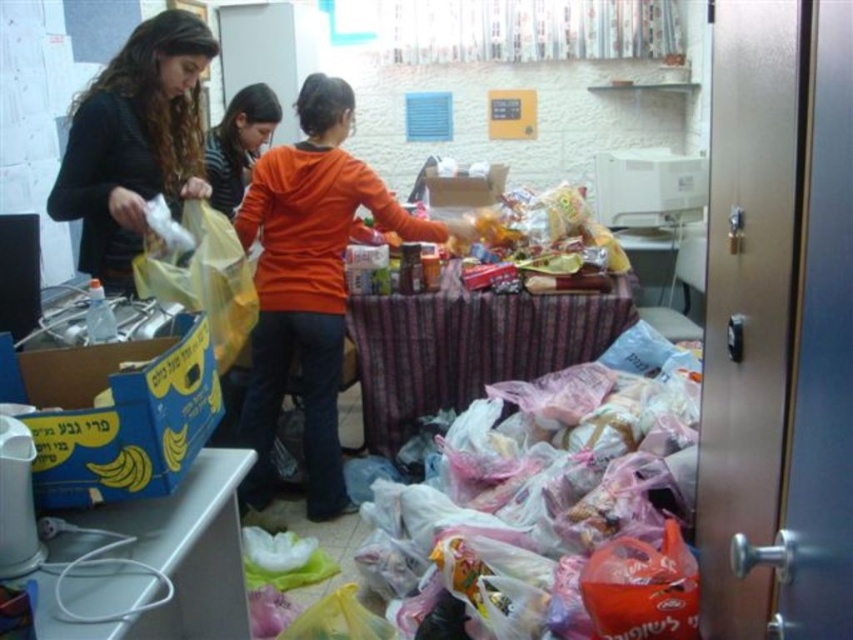
Which is below, orange matte sweater at center or blue cardboard box at lower left?

blue cardboard box at lower left

Can you confirm if orange matte sweater at center is positioned to the right of blue cardboard box at lower left?

Yes, orange matte sweater at center is to the right of blue cardboard box at lower left.

Locate an element on the screen. This screenshot has height=640, width=853. orange matte sweater at center is located at coordinates (309, 285).

Is point (454, 378) less distant than point (108, 472)?

No, (454, 378) is further to viewer.

Is point (352, 339) closer to camera compared to point (115, 464)?

No, (352, 339) is behind (115, 464).

Find the location of `wooden table at center`. wooden table at center is located at coordinates (468, 346).

Does point (212, 132) lie behind point (115, 461)?

Yes, point (212, 132) is behind point (115, 461).

Does orange matte shirt at center come in front of yellow matte bananas at lower left?

No, it is not.

Is point (268, 109) positioned in front of point (132, 454)?

No, (268, 109) is further to viewer.

Locate an element on the screen. The width and height of the screenshot is (853, 640). orange matte shirt at center is located at coordinates (238, 144).